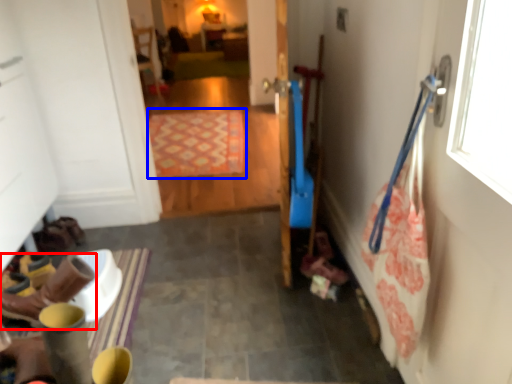
Question: Which object is closer to the camera taking this photo, footwear (highlighted by a red box) or mat (highlighted by a blue box)?

Choices:
 (A) footwear
 (B) mat

Answer: (A)